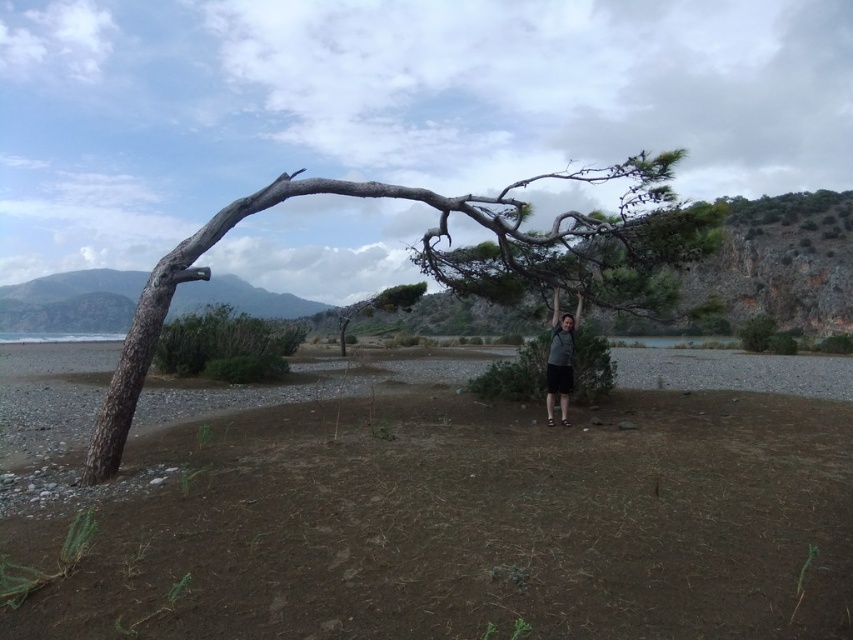
Question: Which object appears closest to the camera in this image?

Choices:
 (A) gray bark tree at center
 (B) brown dirt at center

Answer: (B)

Question: Considering the relative positions of gray bark tree at center and dark gray fabric shirt at center in the image provided, where is gray bark tree at center located with respect to dark gray fabric shirt at center?

Choices:
 (A) left
 (B) right

Answer: (A)

Question: Which point is farther to the camera?

Choices:
 (A) gray bark tree at center
 (B) dark gray fabric shirt at center

Answer: (B)

Question: Is the position of brown dirt at center more distant than that of gray bark tree at center?

Choices:
 (A) no
 (B) yes

Answer: (A)

Question: Estimate the real-world distances between objects in this image. Which object is farther from the gray bark tree at center?

Choices:
 (A) dark gray fabric shirt at center
 (B) brown dirt at center

Answer: (B)

Question: Can you confirm if gray bark tree at center is bigger than dark gray fabric shirt at center?

Choices:
 (A) no
 (B) yes

Answer: (B)